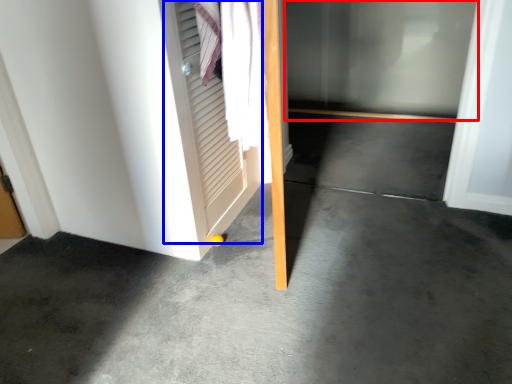
Question: Which point is closer to the camera, glass door (highlighted by a red box) or screen door (highlighted by a blue box)?

Choices:
 (A) glass door
 (B) screen door

Answer: (B)